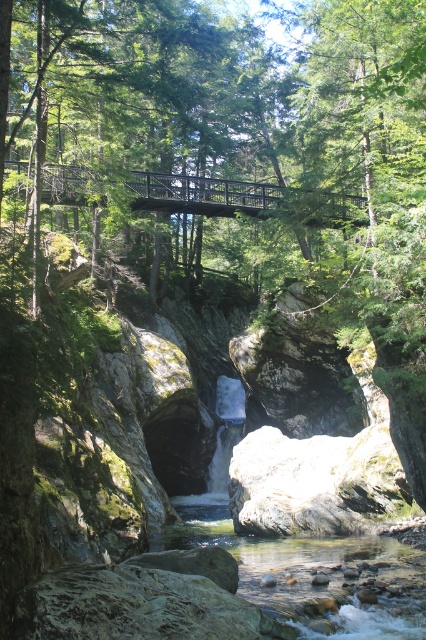
Question: Is clear smooth rock at center to the right of black metal bridge at center from the viewer's perspective?

Choices:
 (A) yes
 (B) no

Answer: (A)

Question: Which object appears closest to the camera in this image?

Choices:
 (A) black metal bridge at center
 (B) clear smooth rock at center

Answer: (B)

Question: Is clear smooth rock at center smaller than black metal bridge at center?

Choices:
 (A) yes
 (B) no

Answer: (A)

Question: Does clear smooth rock at center appear on the left side of black metal bridge at center?

Choices:
 (A) yes
 (B) no

Answer: (B)